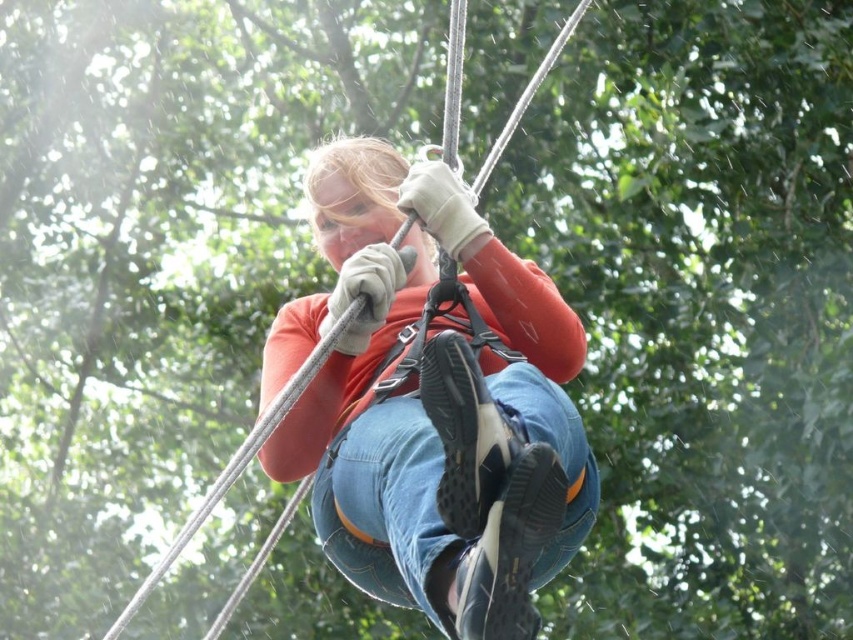
From the picture: You are a photographer trying to capture the person in the image. You notice the matte orange shirt at center and the denim at center. Which item should you focus on first if you want to emphasize the foreground in your photo?

The matte orange shirt at center is further to the viewer than the denim at center, so you should focus on the matte orange shirt at center first to emphasize the foreground.

You are a hiker who just arrived at a forest trail and see a person in the distance. The person is wearing a red long sleeved shirt, blue jeans, black sneakers with white soles, and safety gear. You notice a point at coordinate (422, 394). What object is located at that point?

The point at coordinate (422, 394) corresponds to the matte orange shirt at center.

You are a safety inspector checking the distance between the matte orange shirt at center and the denim at center in the ziplining setup. The safety regulations require a minimum of 1.5 meters between these two items for proper harness attachment. Does this setup comply with the safety standards?

The matte orange shirt at center is 1.52 meters away from the denim at center, which meets the minimum requirement of 1.5 meters. Therefore, the setup complies with the safety standards.